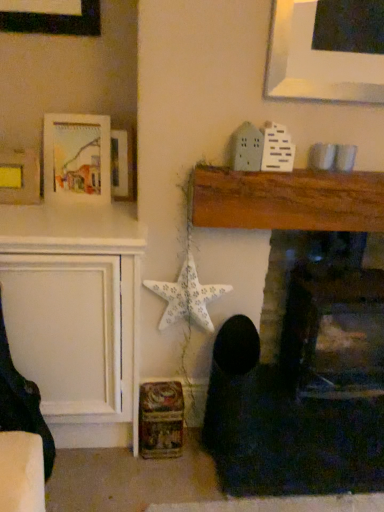
Where is `free space in front of smooth stone fireplace at center, which appears as the 1th fireplace when viewed from the right`? This screenshot has width=384, height=512. free space in front of smooth stone fireplace at center, which appears as the 1th fireplace when viewed from the right is located at coordinates (322, 459).